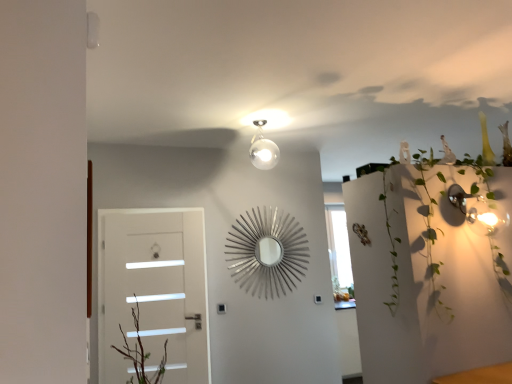
Question: From the image's perspective, is white glossy door at left located above or below green leafy plant at upper right?

Choices:
 (A) above
 (B) below

Answer: (B)

Question: Considering their positions, is white glossy door at left located in front of or behind green leafy plant at upper right?

Choices:
 (A) front
 (B) behind

Answer: (B)

Question: In terms of width, does white glossy door at left look wider or thinner when compared to green leafy plant at upper right?

Choices:
 (A) wide
 (B) thin

Answer: (B)

Question: Is point (510, 294) closer or farther from the camera than point (143, 253)?

Choices:
 (A) closer
 (B) farther

Answer: (A)

Question: Is green leafy plant at upper right wider or thinner than white glossy door at left?

Choices:
 (A) wide
 (B) thin

Answer: (A)

Question: Considering the positions of green leafy plant at upper right and white glossy door at left in the image, is green leafy plant at upper right bigger or smaller than white glossy door at left?

Choices:
 (A) small
 (B) big

Answer: (B)

Question: From a real-world perspective, is green leafy plant at upper right above or below white glossy door at left?

Choices:
 (A) below
 (B) above

Answer: (B)